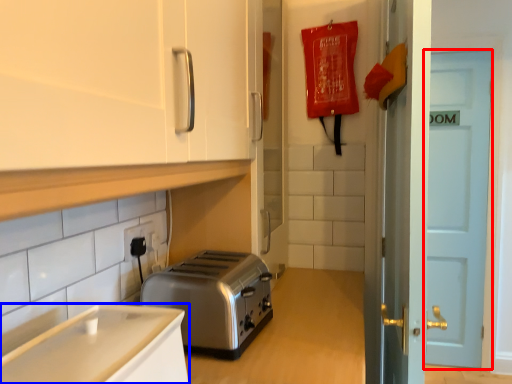
Question: Which object appears closest to the camera in this image, door (highlighted by a red box) or cabinetry (highlighted by a blue box)?

Choices:
 (A) door
 (B) cabinetry

Answer: (B)